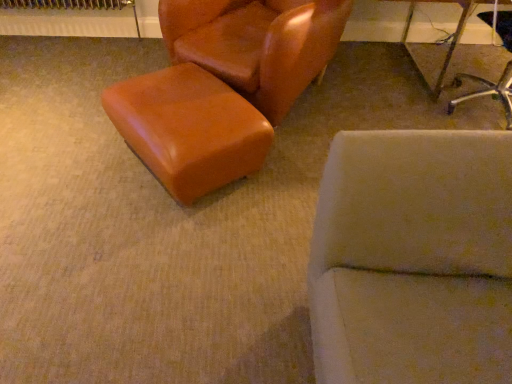
Locate an element on the screen. This screenshot has height=384, width=512. metallic silver chair at upper right, which is the first chair in right-to-left order is located at coordinates (488, 91).

The height and width of the screenshot is (384, 512). Describe the element at coordinates (256, 44) in the screenshot. I see `leather-like brown chair at upper left, the 1th chair viewed from the left` at that location.

What are the coordinates of `satin brown ottoman at center` in the screenshot? It's located at 188,129.

At what (x,y) coordinates should I click in order to perform the action: click on metallic silver chair at upper right, marked as the second chair in a left-to-right arrangement. Please return your answer as a coordinate pair (x, y). The height and width of the screenshot is (384, 512). Looking at the image, I should click on click(x=488, y=91).

From the image's perspective, relative to metallic silver chair at upper right, marked as the second chair in a left-to-right arrangement, is satin brown ottoman at center above or below?

Based on their image positions, satin brown ottoman at center is located beneath metallic silver chair at upper right, marked as the second chair in a left-to-right arrangement.

Between satin brown ottoman at center and metallic silver chair at upper right, which is the first chair in right-to-left order, which one appears on the left side from the viewer's perspective?

satin brown ottoman at center.

Is satin brown ottoman at center further to the viewer compared to metallic silver chair at upper right, marked as the second chair in a left-to-right arrangement?

No, the depth of satin brown ottoman at center is less than that of metallic silver chair at upper right, marked as the second chair in a left-to-right arrangement.

From a real-world perspective, who is located higher, satin brown ottoman at center or metallic silver chair at upper right, marked as the second chair in a left-to-right arrangement?

In real-world perspective, metallic silver chair at upper right, marked as the second chair in a left-to-right arrangement, is above.

From a real-world perspective, who is located higher, metallic silver chair at upper right, which is the first chair in right-to-left order, or leather-like brown chair at upper left, the 1th chair viewed from the left?

leather-like brown chair at upper left, the 1th chair viewed from the left, from a real-world perspective.

Based on the photo, is metallic silver chair at upper right, which is the first chair in right-to-left order, not inside leather-like brown chair at upper left, which is the second chair in right-to-left order?

Indeed, metallic silver chair at upper right, which is the first chair in right-to-left order, is completely outside leather-like brown chair at upper left, which is the second chair in right-to-left order.

Can you confirm if metallic silver chair at upper right, marked as the second chair in a left-to-right arrangement, is positioned to the left of leather-like brown chair at upper left, which is the second chair in right-to-left order?

Incorrect, metallic silver chair at upper right, marked as the second chair in a left-to-right arrangement, is not on the left side of leather-like brown chair at upper left, which is the second chair in right-to-left order.

Looking at this image, can you tell me how much leather-like brown chair at upper left, the 1th chair viewed from the left, and metallic silver chair at upper right, which is the first chair in right-to-left order, differ in facing direction?

There is a 141-degree angle between the facing directions of leather-like brown chair at upper left, the 1th chair viewed from the left, and metallic silver chair at upper right, which is the first chair in right-to-left order.

Can you confirm if leather-like brown chair at upper left, which is the second chair in right-to-left order, is wider than metallic silver chair at upper right, which is the first chair in right-to-left order?

Correct, the width of leather-like brown chair at upper left, which is the second chair in right-to-left order, exceeds that of metallic silver chair at upper right, which is the first chair in right-to-left order.

Are leather-like brown chair at upper left, which is the second chair in right-to-left order, and metallic silver chair at upper right, which is the first chair in right-to-left order, making contact?

No, leather-like brown chair at upper left, which is the second chair in right-to-left order, is not beside metallic silver chair at upper right, which is the first chair in right-to-left order.

From a real-world perspective, between leather-like brown chair at upper left, which is the second chair in right-to-left order, and metallic silver chair at upper right, marked as the second chair in a left-to-right arrangement, who is vertically higher?

leather-like brown chair at upper left, which is the second chair in right-to-left order, from a real-world perspective.

Is satin brown ottoman at center in contact with leather-like brown chair at upper left, which is the second chair in right-to-left order?

There is a gap between satin brown ottoman at center and leather-like brown chair at upper left, which is the second chair in right-to-left order.

Which of these two, satin brown ottoman at center or leather-like brown chair at upper left, which is the second chair in right-to-left order, stands shorter?

Standing shorter between the two is satin brown ottoman at center.

From the image's perspective, relative to leather-like brown chair at upper left, which is the second chair in right-to-left order, is satin brown ottoman at center above or below?

Based on their image positions, satin brown ottoman at center is located beneath leather-like brown chair at upper left, which is the second chair in right-to-left order.

Does satin brown ottoman at center appear on the left side of leather-like brown chair at upper left, which is the second chair in right-to-left order?

Indeed, satin brown ottoman at center is positioned on the left side of leather-like brown chair at upper left, which is the second chair in right-to-left order.

Who is bigger, metallic silver chair at upper right, marked as the second chair in a left-to-right arrangement, or satin brown ottoman at center?

metallic silver chair at upper right, marked as the second chair in a left-to-right arrangement, is bigger.

Is metallic silver chair at upper right, which is the first chair in right-to-left order, situated inside satin brown ottoman at center or outside?

metallic silver chair at upper right, which is the first chair in right-to-left order, is spatially situated outside satin brown ottoman at center.

Which of these two, metallic silver chair at upper right, which is the first chair in right-to-left order, or satin brown ottoman at center, stands shorter?

Standing shorter between the two is satin brown ottoman at center.

Is metallic silver chair at upper right, which is the first chair in right-to-left order, facing away from satin brown ottoman at center?

That's not correct — metallic silver chair at upper right, which is the first chair in right-to-left order, is not looking away from satin brown ottoman at center.

Is leather-like brown chair at upper left, which is the second chair in right-to-left order, positioned with its back to satin brown ottoman at center?

No.

Is leather-like brown chair at upper left, which is the second chair in right-to-left order, smaller than satin brown ottoman at center?

No, leather-like brown chair at upper left, which is the second chair in right-to-left order, is not smaller than satin brown ottoman at center.

Is point (280, 110) closer or farther from the camera than point (182, 98)?

Point (280, 110) is farther from the camera than point (182, 98).

Does leather-like brown chair at upper left, which is the second chair in right-to-left order, touch satin brown ottoman at center?

No, leather-like brown chair at upper left, which is the second chair in right-to-left order, is not with satin brown ottoman at center.

There is a satin brown ottoman at center. At what (x,y) coordinates should I click in order to perform the action: click on the 1st chair above it (from a real-world perspective). Please return your answer as a coordinate pair (x, y). Image resolution: width=512 pixels, height=384 pixels. Looking at the image, I should click on (488, 91).

I want to click on chair that is on the left side of metallic silver chair at upper right, which is the first chair in right-to-left order, so click(x=256, y=44).

Estimate the real-world distances between objects in this image. Which object is further from leather-like brown chair at upper left, the 1th chair viewed from the left, metallic silver chair at upper right, which is the first chair in right-to-left order, or satin brown ottoman at center?

metallic silver chair at upper right, which is the first chair in right-to-left order, is further to leather-like brown chair at upper left, the 1th chair viewed from the left.

Looking at the image, which one is located further to metallic silver chair at upper right, which is the first chair in right-to-left order, leather-like brown chair at upper left, which is the second chair in right-to-left order, or satin brown ottoman at center?

Among the two, satin brown ottoman at center is located further to metallic silver chair at upper right, which is the first chair in right-to-left order.

When comparing their distances from satin brown ottoman at center, does metallic silver chair at upper right, which is the first chair in right-to-left order, or leather-like brown chair at upper left, which is the second chair in right-to-left order, seem closer?

Based on the image, leather-like brown chair at upper left, which is the second chair in right-to-left order, appears to be nearer to satin brown ottoman at center.

When comparing their distances from metallic silver chair at upper right, marked as the second chair in a left-to-right arrangement, does satin brown ottoman at center or leather-like brown chair at upper left, the 1th chair viewed from the left, seem closer?

The object closer to metallic silver chair at upper right, marked as the second chair in a left-to-right arrangement, is leather-like brown chair at upper left, the 1th chair viewed from the left.

Estimate the real-world distances between objects in this image. Which object is further from leather-like brown chair at upper left, the 1th chair viewed from the left, satin brown ottoman at center or metallic silver chair at upper right, marked as the second chair in a left-to-right arrangement?

The object further to leather-like brown chair at upper left, the 1th chair viewed from the left, is metallic silver chair at upper right, marked as the second chair in a left-to-right arrangement.

Considering their positions, is leather-like brown chair at upper left, the 1th chair viewed from the left, positioned further to satin brown ottoman at center than metallic silver chair at upper right, which is the first chair in right-to-left order?

metallic silver chair at upper right, which is the first chair in right-to-left order.

This screenshot has width=512, height=384. What are the coordinates of `chair between satin brown ottoman at center and metallic silver chair at upper right, which is the first chair in right-to-left order, in the horizontal direction` in the screenshot? It's located at (256, 44).